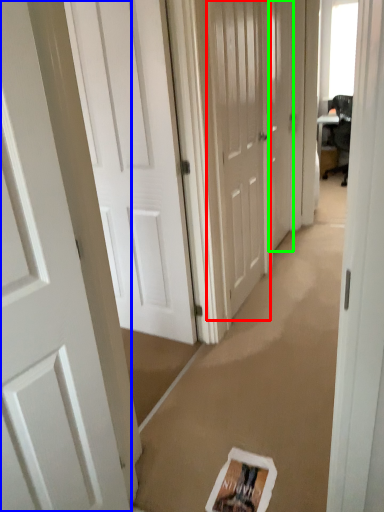
Question: Which object is positioned closest to door (highlighted by a red box)? Select from door (highlighted by a blue box) and door (highlighted by a green box).

Choices:
 (A) door
 (B) door

Answer: (B)